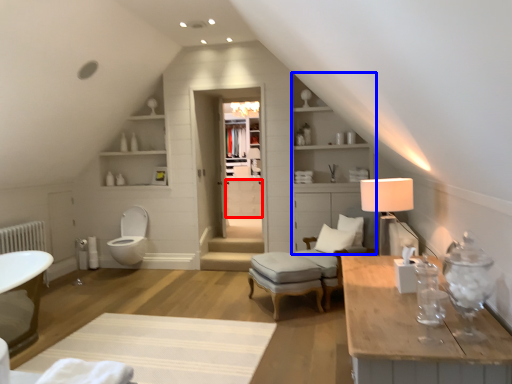
Question: Among these objects, which one is nearest to the camera, drawer (highlighted by a red box) or dresser (highlighted by a blue box)?

Choices:
 (A) drawer
 (B) dresser

Answer: (B)